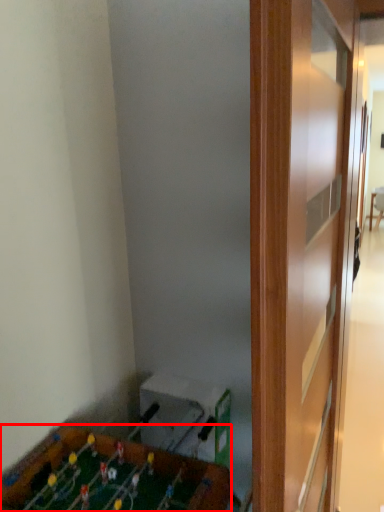
Question: From the image, what is the correct spatial relationship of furniture (annotated by the red box) in relation to table?

Choices:
 (A) left
 (B) right

Answer: (A)